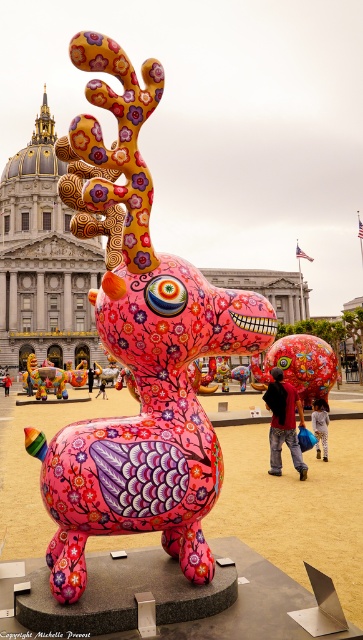
You are an artist planning to photograph the pink glossy deer at center and the shiny metallic elephant at center from a distance. Based on their sizes, which one would appear larger in the photo?

The pink glossy deer at center is taller than the shiny metallic elephant at center, so it would appear larger in the photo.

You are standing in front of a public art installation. You see a point marked at coordinates (x=139, y=349). What object is located at that point?

The pink glossy deer at center is located at point (x=139, y=349).